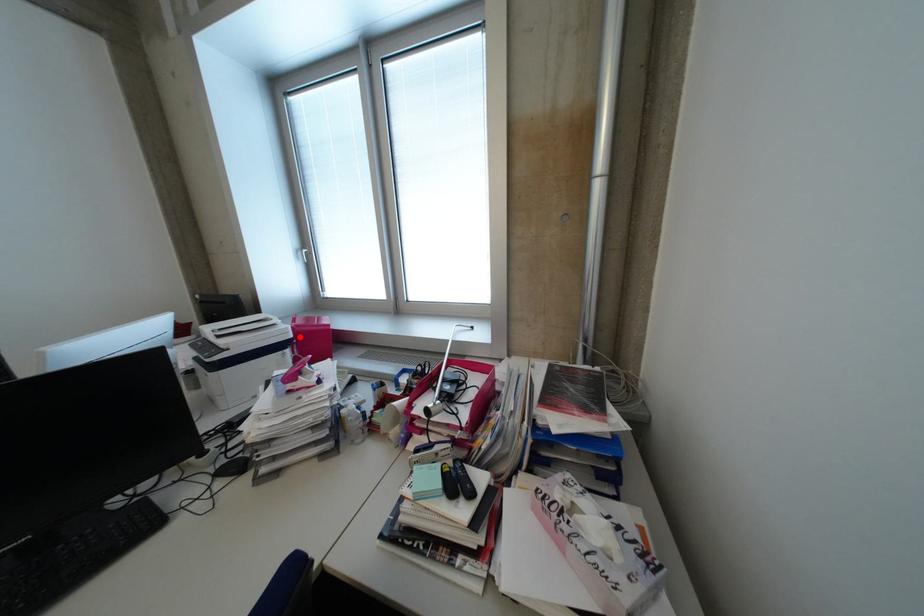
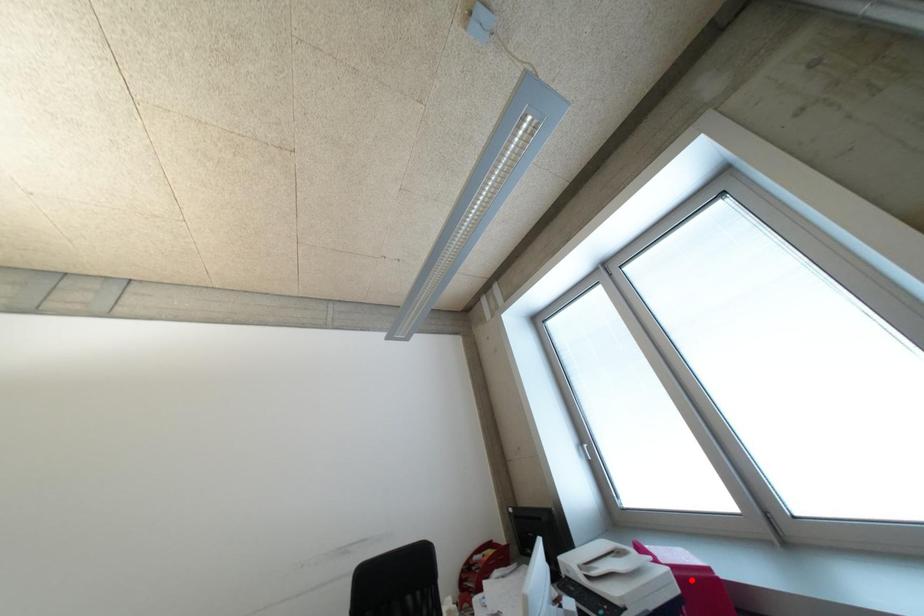
I am providing you with two images of the same scene from different viewpoints. A red point is marked on the first image and another point is marked on the second image. Is the red point in image1 aligned with the point shown in image2?

No